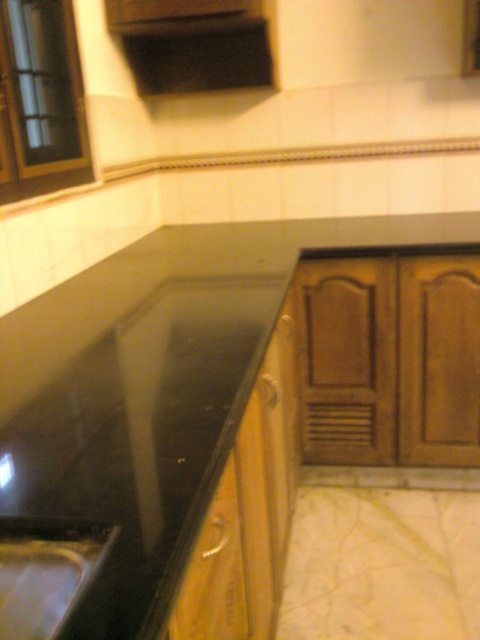
Question: Which object appears farthest from the camera in this image?

Choices:
 (A) black glossy sink at lower left
 (B) wooden drawer at lower center
 (C) black matte exhaust hood at upper center

Answer: (C)

Question: Is black matte exhaust hood at upper center positioned in front of wooden drawer at lower center?

Choices:
 (A) no
 (B) yes

Answer: (A)

Question: Estimate the real-world distances between objects in this image. Which object is farther from the black granite countertop at center?

Choices:
 (A) black glossy sink at lower left
 (B) wooden drawer at lower center
 (C) black matte exhaust hood at upper center

Answer: (A)

Question: Does black matte exhaust hood at upper center appear on the right side of black glossy sink at lower left?

Choices:
 (A) yes
 (B) no

Answer: (A)

Question: Which point is closer to the camera taking this photo?

Choices:
 (A) (211, 3)
 (B) (101, 541)
 (C) (252, 250)
 (D) (229, 513)

Answer: (B)

Question: Does black granite countertop at center appear under black glossy sink at lower left?

Choices:
 (A) yes
 (B) no

Answer: (B)